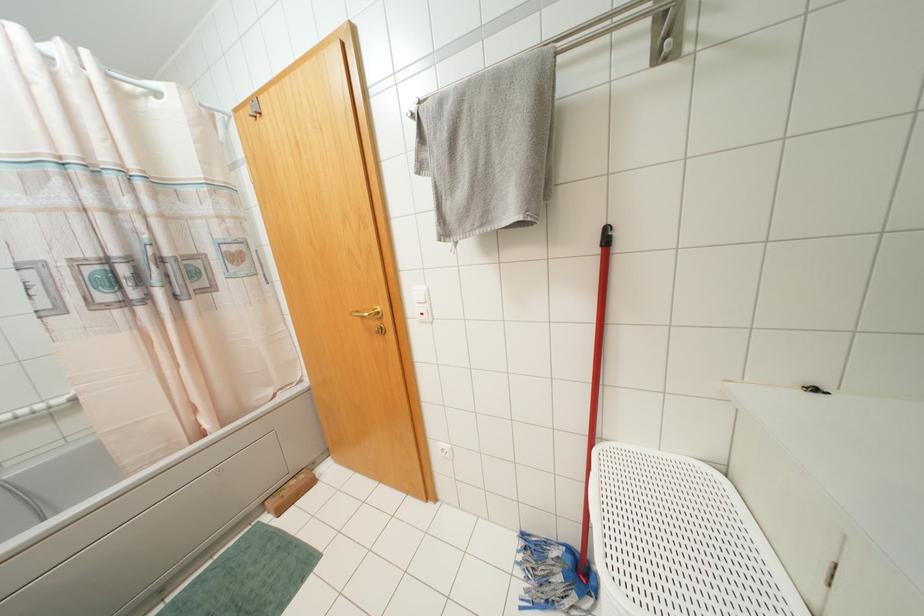
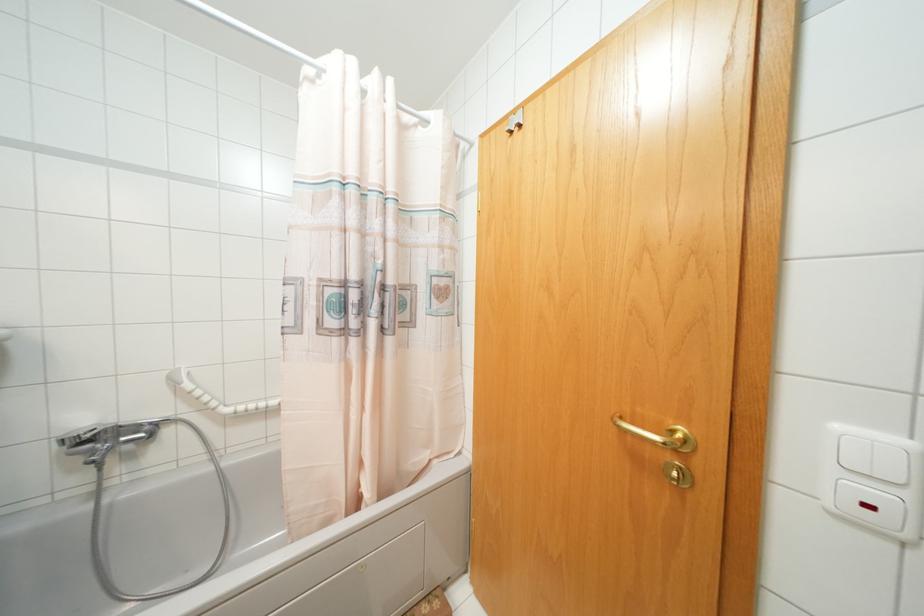
What movement of the cameraman would produce the second image?

The cameraman moved toward left, forward.